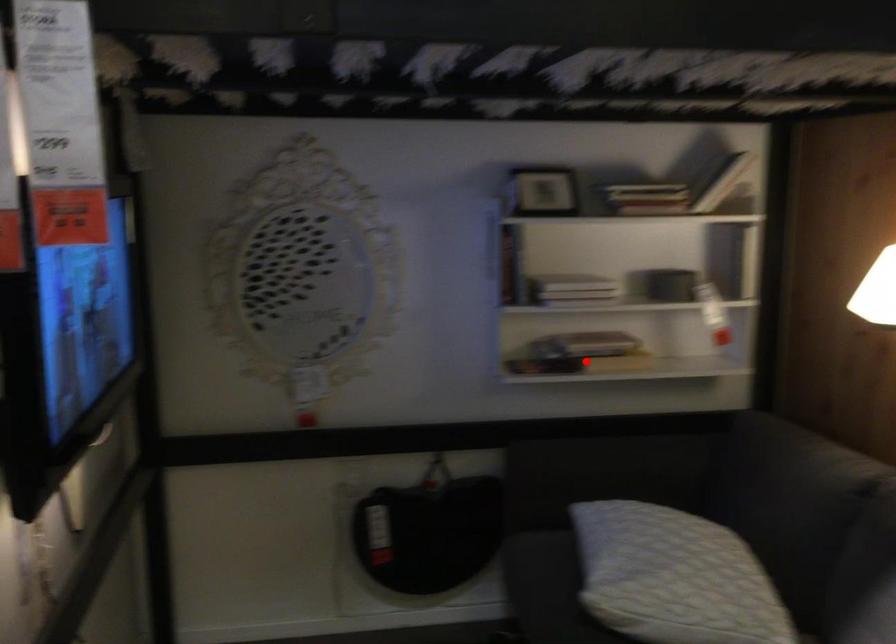
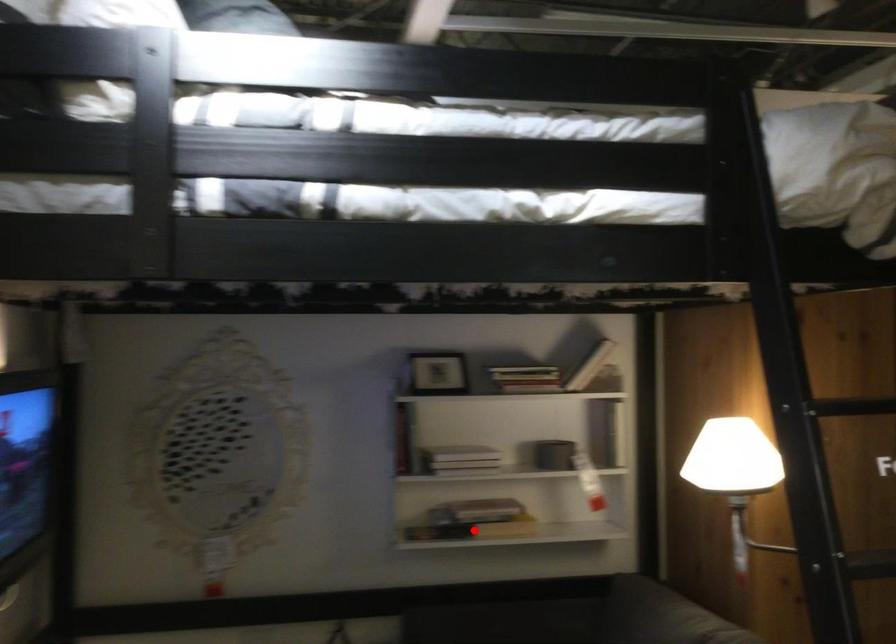
I am providing you with two images of the same scene from different viewpoints. A red point is marked on the first image and another point is marked on the second image. Is the red point in image1 aligned with the point shown in image2?

Yes